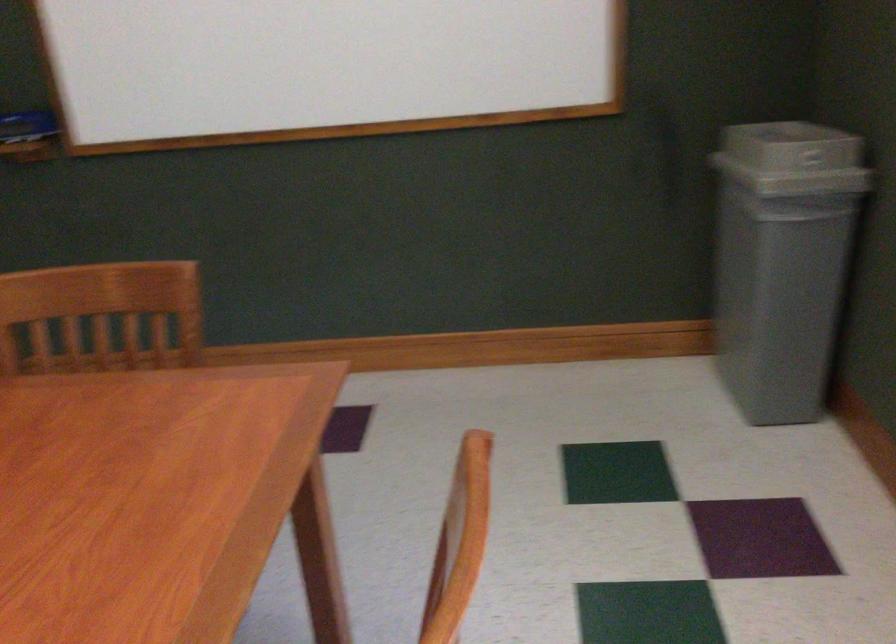
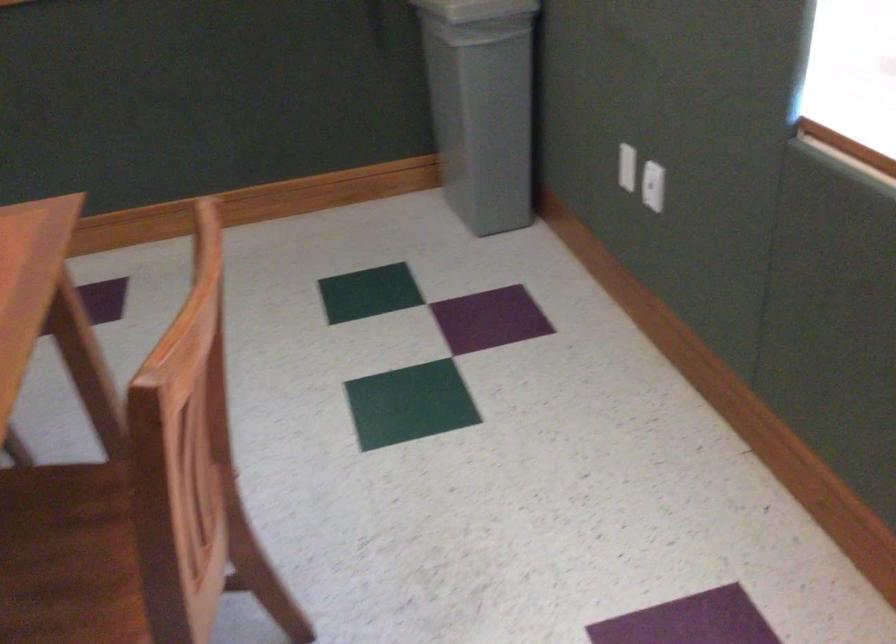
Question: What movement of the cameraman would produce the second image?

Choices:
 (A) Left
 (B) Right
 (C) Forward
 (D) Backward

Answer: (D)